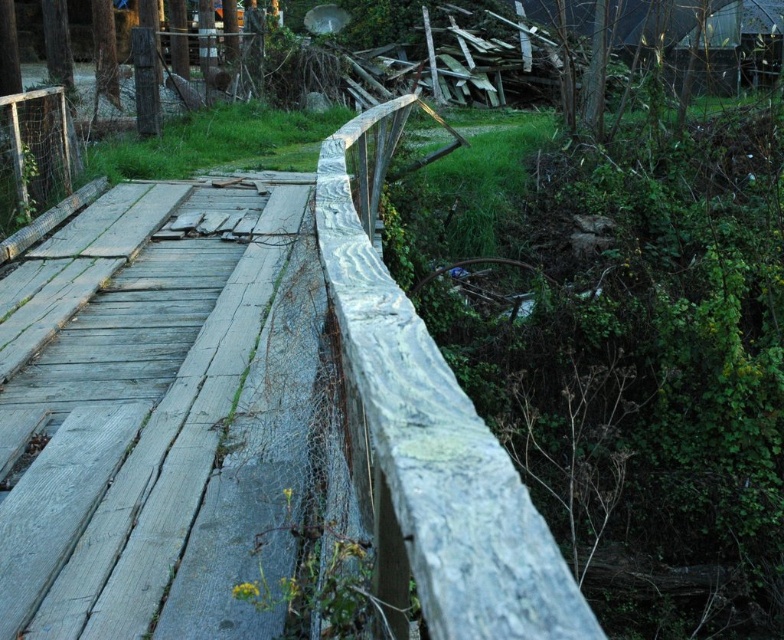
Which of these two, weathered wood planks at center or weathered wood rail at center, stands taller?

weathered wood rail at center

Can you confirm if weathered wood planks at center is positioned to the left of weathered wood rail at center?

Indeed, weathered wood planks at center is positioned on the left side of weathered wood rail at center.

The width and height of the screenshot is (784, 640). What are the coordinates of `weathered wood planks at center` in the screenshot? It's located at (165, 428).